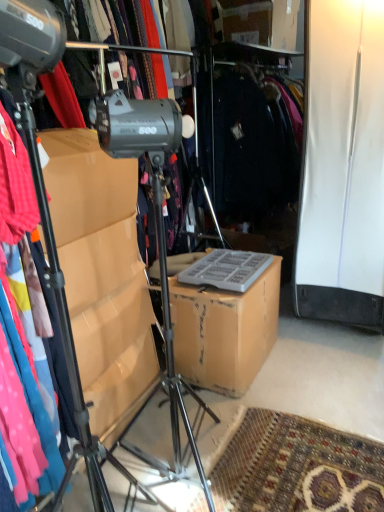
What do you see at coordinates (223, 328) in the screenshot? I see `brown cardboard box at center` at bounding box center [223, 328].

Find the location of `brown cardboard box at center`. brown cardboard box at center is located at coordinates (223, 328).

At what (x,y) coordinates should I click in order to perform the action: click on metallic tripod at left. Please return your answer as a coordinate pair (x, y). The height and width of the screenshot is (512, 384). Looking at the image, I should click on (72, 342).

The height and width of the screenshot is (512, 384). Describe the element at coordinates (72, 342) in the screenshot. I see `metallic tripod at left` at that location.

Identify the location of brown cardboard box at center. (223, 328).

Which is more to the left, brown cardboard box at center or metallic tripod at left?

metallic tripod at left.

In the image, is brown cardboard box at center positioned in front of or behind metallic tripod at left?

Clearly, brown cardboard box at center is behind metallic tripod at left.

Does point (208, 310) come in front of point (82, 430)?

No, it is not.

From the image's perspective, who appears lower, brown cardboard box at center or metallic tripod at left?

brown cardboard box at center, from the image's perspective.

From a real-world perspective, is brown cardboard box at center above or below metallic tripod at left?

brown cardboard box at center is situated lower than metallic tripod at left in the real world.

Considering the sizes of objects brown cardboard box at center and metallic tripod at left in the image provided, who is wider, brown cardboard box at center or metallic tripod at left?

With larger width is metallic tripod at left.

Does brown cardboard box at center have a lesser height compared to metallic tripod at left?

Indeed, brown cardboard box at center has a lesser height compared to metallic tripod at left.

Looking at the image, does brown cardboard box at center seem bigger or smaller compared to metallic tripod at left?

brown cardboard box at center is smaller than metallic tripod at left.

Would you say brown cardboard box at center is inside or outside metallic tripod at left?

brown cardboard box at center lies outside metallic tripod at left.

Is brown cardboard box at center directly adjacent to metallic tripod at left?

No, brown cardboard box at center is not next to metallic tripod at left.

Could you tell me if brown cardboard box at center is turned towards metallic tripod at left?

No, brown cardboard box at center is not aimed at metallic tripod at left.

Image resolution: width=384 pixels, height=512 pixels. In the image, there is a metallic tripod at left. What are the coordinates of `cardboard box below it (from the image's perspective)` in the screenshot? It's located at (223, 328).

Considering the relative positions of metallic tripod at left and brown cardboard box at center in the image provided, is metallic tripod at left to the right of brown cardboard box at center from the viewer's perspective?

In fact, metallic tripod at left is to the left of brown cardboard box at center.

Is the depth of metallic tripod at left greater than that of brown cardboard box at center?

No.

Considering the points (51, 249) and (155, 278), which point is in front, point (51, 249) or point (155, 278)?

Positioned in front is point (51, 249).

From the image's perspective, which one is positioned lower, metallic tripod at left or brown cardboard box at center?

From the image's view, brown cardboard box at center is below.

From a real-world perspective, which object stands above the other?

From a 3D spatial view, metallic tripod at left is above.

Considering the sizes of objects metallic tripod at left and brown cardboard box at center in the image provided, who is wider, metallic tripod at left or brown cardboard box at center?

metallic tripod at left is wider.

In terms of height, does metallic tripod at left look taller or shorter compared to brown cardboard box at center?

In the image, metallic tripod at left appears to be taller than brown cardboard box at center.

Looking at the image, does metallic tripod at left seem bigger or smaller compared to brown cardboard box at center?

Considering their sizes, metallic tripod at left takes up more space than brown cardboard box at center.

Is metallic tripod at left completely or partially outside of brown cardboard box at center?

Indeed, metallic tripod at left is completely outside brown cardboard box at center.

Is metallic tripod at left touching brown cardboard box at center?

They are not placed beside each other.

Is metallic tripod at left turned away from brown cardboard box at center?

That's not correct — metallic tripod at left is not looking away from brown cardboard box at center.

Where is `tripod above the brown cardboard box at center (from the image's perspective)`? tripod above the brown cardboard box at center (from the image's perspective) is located at coordinates (72, 342).

Where is `tripod that is above the brown cardboard box at center (from a real-world perspective)`? tripod that is above the brown cardboard box at center (from a real-world perspective) is located at coordinates (72, 342).

Where is `cardboard box on the right of the metallic tripod at left`? This screenshot has width=384, height=512. cardboard box on the right of the metallic tripod at left is located at coordinates (223, 328).